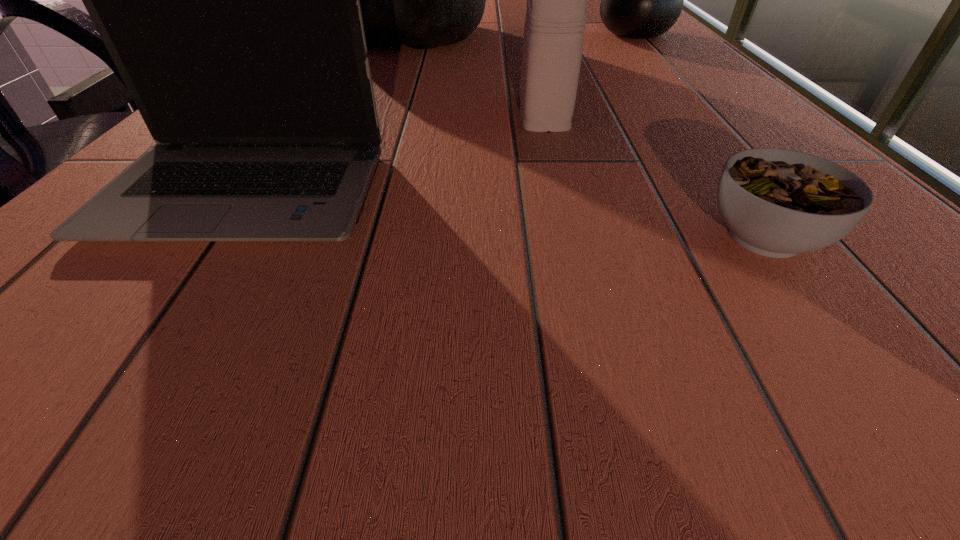
This screenshot has height=540, width=960. In order to click on plastic bag in this screenshot , I will do `click(423, 0)`.

Find the location of a particular element. This screenshot has width=960, height=540. the second tallest object is located at coordinates (639, 0).

Find the location of a particular element. The height and width of the screenshot is (540, 960). detergent is located at coordinates (556, 15).

Locate an element on the screen. The height and width of the screenshot is (540, 960). the third object from left to right is located at coordinates (556, 15).

Locate an element on the screen. The image size is (960, 540). laptop computer is located at coordinates (229, 0).

Identify the location of the shortest object. This screenshot has height=540, width=960. (777, 203).

The width and height of the screenshot is (960, 540). In order to click on vacant space located 0.140m on the right of the tallest object in this screenshot , I will do `click(544, 32)`.

Locate an element on the screen. free spot located 0.080m on the left of the fourth shortest object is located at coordinates (563, 34).

You are a GUI agent. You are given a task and a screenshot of the screen. Output one action in this format:
    pyautogui.click(x=<x>, y=<y>)
    Task: Click on the free space located on the handle side of the third object from left to right
    The width and height of the screenshot is (960, 540).
    Given the screenshot: What is the action you would take?
    pyautogui.click(x=524, y=37)

Find the location of a particular element. This screenshot has height=540, width=960. vacant area situated on the handle side of the third object from left to right is located at coordinates (531, 65).